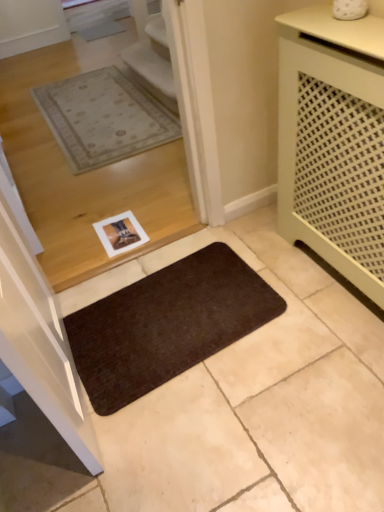
Question: From the image's perspective, is brown matte mat at lower center located above or below matte green cabinet at right?

Choices:
 (A) above
 (B) below

Answer: (B)

Question: In terms of height, does brown matte mat at lower center look taller or shorter compared to matte green cabinet at right?

Choices:
 (A) tall
 (B) short

Answer: (B)

Question: Looking at the image, does brown matte mat at lower center seem bigger or smaller compared to matte green cabinet at right?

Choices:
 (A) big
 (B) small

Answer: (B)

Question: In terms of size, does matte green cabinet at right appear bigger or smaller than brown matte mat at lower center?

Choices:
 (A) big
 (B) small

Answer: (A)

Question: From a real-world perspective, is matte green cabinet at right positioned above or below brown matte mat at lower center?

Choices:
 (A) above
 (B) below

Answer: (A)

Question: Looking at their shapes, would you say matte green cabinet at right is wider or thinner than brown matte mat at lower center?

Choices:
 (A) thin
 (B) wide

Answer: (A)

Question: Is matte green cabinet at right in front of or behind brown matte mat at lower center in the image?

Choices:
 (A) behind
 (B) front

Answer: (B)